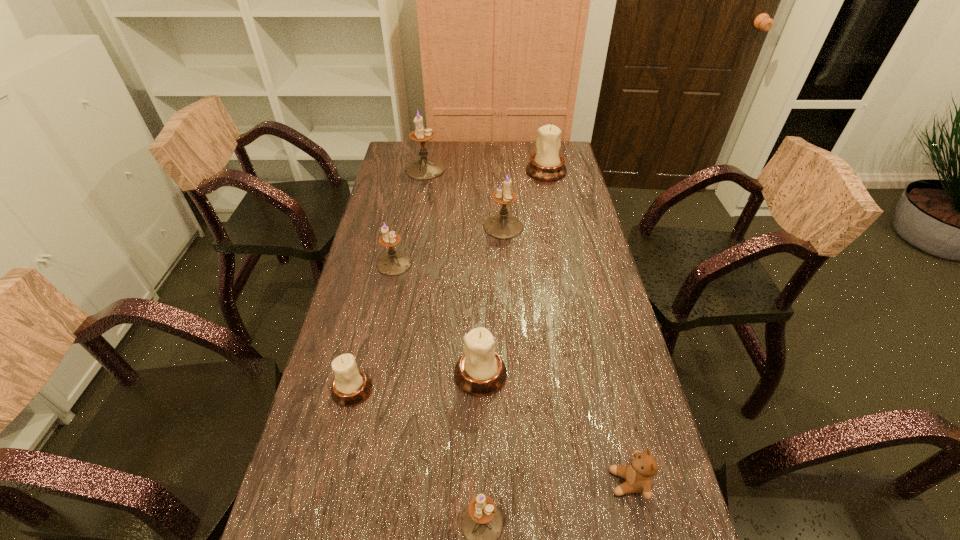
Identify the location of the second closest purple candle holder to the smallest white candle holder. (393, 263).

Where is `purple candle holder object that ranks as the closest to the smallest white candle holder`? purple candle holder object that ranks as the closest to the smallest white candle holder is located at coordinates (482, 524).

Find the location of `white candle holder that stands as the third closest to the fifth nearest candle holder`. white candle holder that stands as the third closest to the fifth nearest candle holder is located at coordinates (351, 386).

Locate which white candle holder ranks second in proximity to the fifth nearest object. Please provide its 2D coordinates. Your answer should be formatted as a tuple, i.e. [(x, y)], where the tuple contains the x and y coordinates of a point satisfying the conditions above.

[(351, 386)]